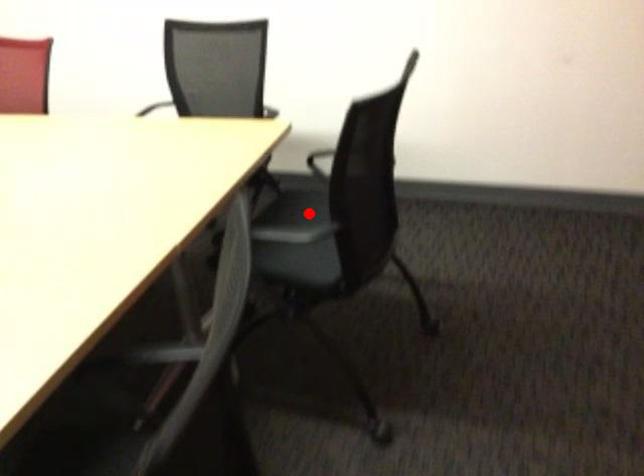
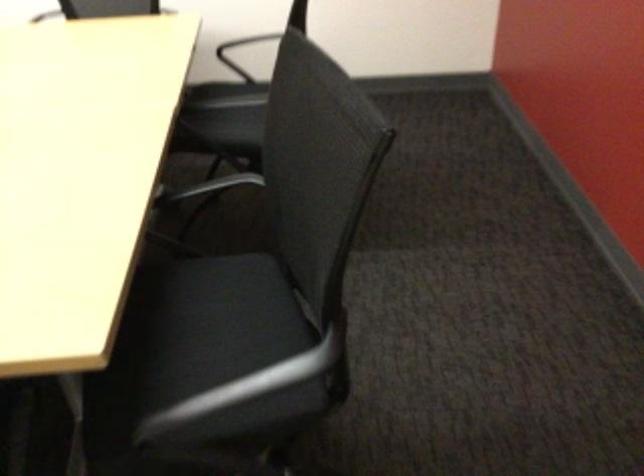
Question: I am providing you with two images of the same scene from different viewpoints. Image1 has a red point marked. In image2, the corresponding 3D location appears at what relative position? Reply with the corresponding letter.

Choices:
 (A) Closer
 (B) Farther

Answer: (B)